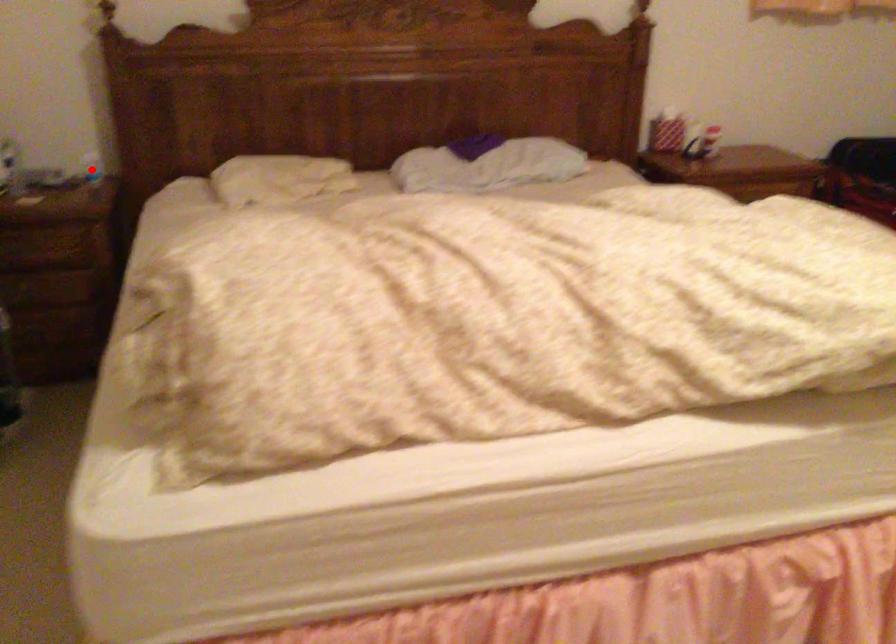
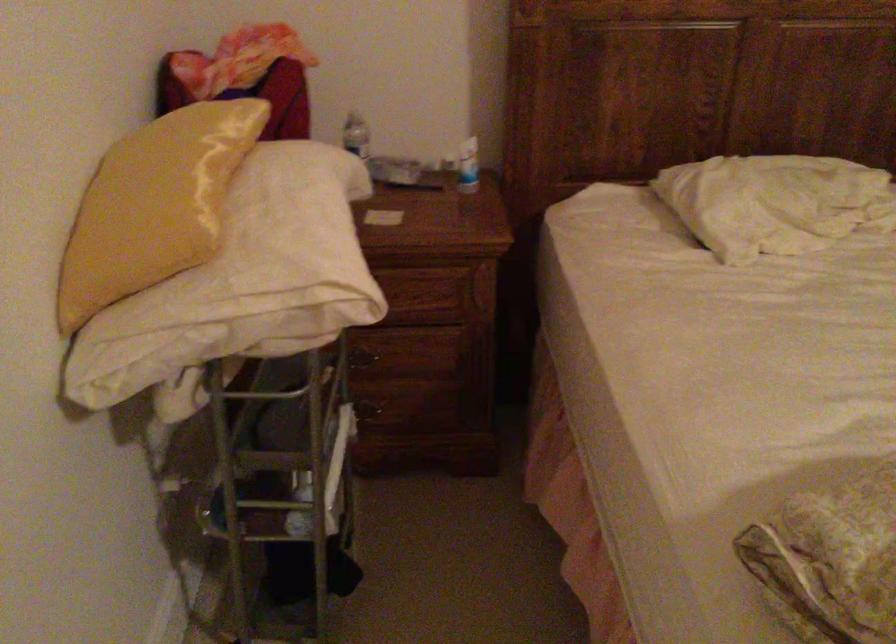
Question: I am providing you with two images of the same scene from different viewpoints. In image1, a red point is highlighted. Considering the same 3D point in image2, which of the following is correct?

Choices:
 (A) It is closer
 (B) It is farther

Answer: (A)